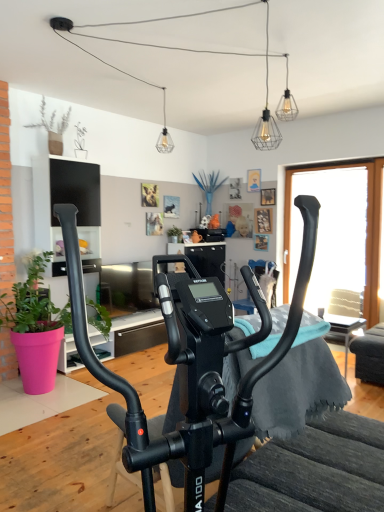
Question: Can you confirm if green matte plant at center, the 2th houseplant in the bottom-to-top sequence, is positioned to the left of pink matte plant pot at left, positioned as the 2th houseplant in back-to-front order?

Choices:
 (A) yes
 (B) no

Answer: (B)

Question: From a real-world perspective, is green matte plant at center, the 1th houseplant in the right-to-left sequence, positioned over pink matte plant pot at left, positioned as the 2th houseplant in back-to-front order, based on gravity?

Choices:
 (A) yes
 (B) no

Answer: (A)

Question: From the image's perspective, is green matte plant at center, the 2th houseplant in the bottom-to-top sequence, located above pink matte plant pot at left, which is counted as the 1th houseplant, starting from the left?

Choices:
 (A) no
 (B) yes

Answer: (B)

Question: Are green matte plant at center, which ranks as the 1th houseplant in top-to-bottom order, and pink matte plant pot at left, the second houseplant viewed from the right, located far from each other?

Choices:
 (A) yes
 (B) no

Answer: (A)

Question: Is the depth of green matte plant at center, which is the first houseplant in back-to-front order, greater than that of pink matte plant pot at left, which is counted as the 1th houseplant, starting from the left?

Choices:
 (A) yes
 (B) no

Answer: (A)

Question: In the image, is green matte plant at center, positioned as the 2th houseplant in left-to-right order, positioned in front of or behind black matte stationary bicycle at center?

Choices:
 (A) behind
 (B) front

Answer: (A)

Question: From a real-world perspective, is green matte plant at center, which is the first houseplant in back-to-front order, above or below black matte stationary bicycle at center?

Choices:
 (A) above
 (B) below

Answer: (A)

Question: Is green matte plant at center, the 2th houseplant in the bottom-to-top sequence, situated inside black matte stationary bicycle at center or outside?

Choices:
 (A) inside
 (B) outside

Answer: (B)

Question: From the image's perspective, is green matte plant at center, the 1th houseplant in the right-to-left sequence, above or below black matte stationary bicycle at center?

Choices:
 (A) below
 (B) above

Answer: (B)

Question: In terms of size, does pink matte plant pot at left, the second houseplant viewed from the right, appear bigger or smaller than wire mesh bulb at upper center, the 2th light fixture when ordered from back to front?

Choices:
 (A) big
 (B) small

Answer: (A)

Question: Is pink matte plant pot at left, which is counted as the 1th houseplant, starting from the left, to the left or to the right of wire mesh bulb at upper center, which is the 3th light fixture from left to right, in the image?

Choices:
 (A) right
 (B) left

Answer: (B)

Question: Do you think pink matte plant pot at left, which is counted as the 1th houseplant, starting from the left, is within wire mesh bulb at upper center, which appears as the 2th light fixture when viewed from the front, or outside of it?

Choices:
 (A) outside
 (B) inside

Answer: (A)

Question: From the image's perspective, is pink matte plant pot at left, which ranks as the 1th houseplant in bottom-to-top order, above or below wire mesh bulb at upper center, the 2th light fixture when ordered from back to front?

Choices:
 (A) above
 (B) below

Answer: (B)

Question: Looking at their shapes, would you say black matte stationary bicycle at center is wider or thinner than clear glass pendant light at upper center, which is counted as the third light fixture, starting from the right?

Choices:
 (A) thin
 (B) wide

Answer: (B)

Question: In terms of height, does black matte stationary bicycle at center look taller or shorter compared to clear glass pendant light at upper center, positioned as the 1th light fixture in back-to-front order?

Choices:
 (A) tall
 (B) short

Answer: (A)